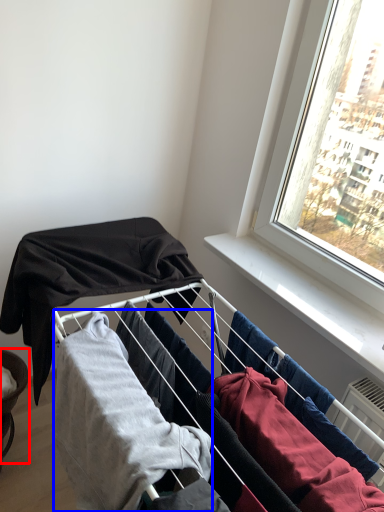
Question: Which of the following is the farthest to the observer, furniture (highlighted by a red box) or clothing (highlighted by a blue box)?

Choices:
 (A) furniture
 (B) clothing

Answer: (A)